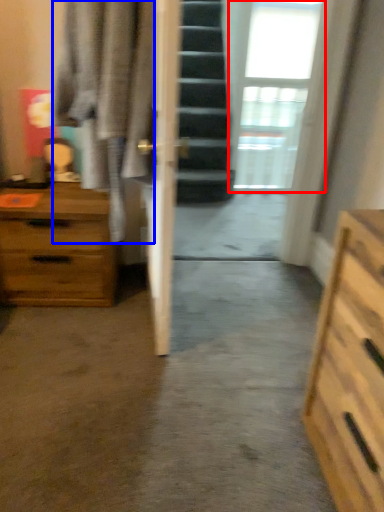
Question: Which object is further to the camera taking this photo, window (highlighted by a red box) or robe (highlighted by a blue box)?

Choices:
 (A) window
 (B) robe

Answer: (A)